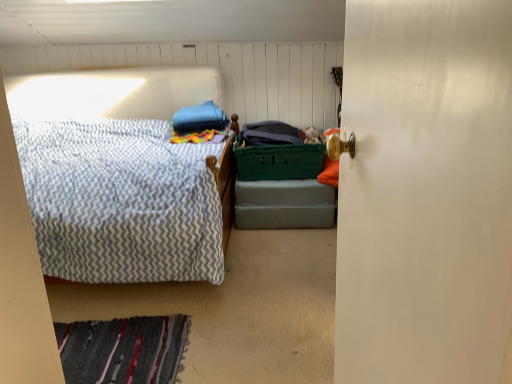
Question: Which is correct: striped wool rug at lower left is inside white glossy door at right, or outside of it?

Choices:
 (A) outside
 (B) inside

Answer: (A)

Question: From the image's perspective, relative to white glossy door at right, is striped wool rug at lower left above or below?

Choices:
 (A) below
 (B) above

Answer: (A)

Question: Which object is positioned closest to the white glossy door at right?

Choices:
 (A) green plastic crate at center
 (B) green plastic laundry basket at center
 (C) striped wool rug at lower left

Answer: (C)

Question: Which object is positioned closest to the striped wool rug at lower left?

Choices:
 (A) white glossy door at right
 (B) green plastic crate at center
 (C) green plastic laundry basket at center

Answer: (B)